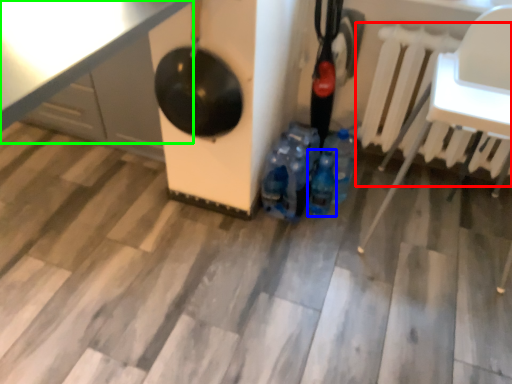
Question: Which object is positioned closest to radiator (highlighted by a red box)? Select from bottle (highlighted by a blue box) and table (highlighted by a green box).

Choices:
 (A) bottle
 (B) table

Answer: (A)